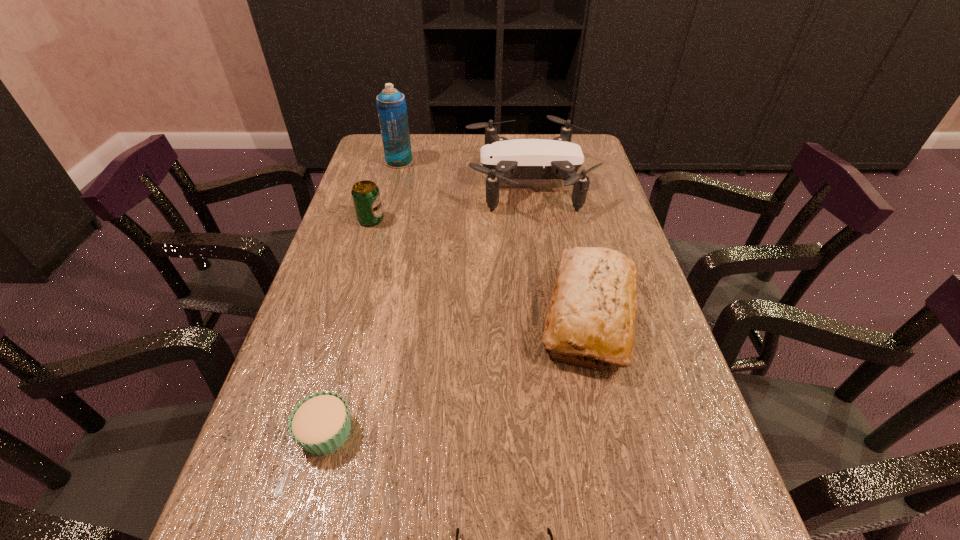
Image resolution: width=960 pixels, height=540 pixels. What are the coordinates of `free space between the bread and the aerosol can` in the screenshot? It's located at (494, 238).

You are a GUI agent. You are given a task and a screenshot of the screen. Output one action in this format:
    pyautogui.click(x=<x>, y=<y>)
    Task: Click on the vacant region between the drone and the fifth farthest object
    Image resolution: width=960 pixels, height=540 pixels.
    Given the screenshot: What is the action you would take?
    pyautogui.click(x=427, y=307)

At what (x,y) coordinates should I click in order to perform the action: click on the fifth closest object to the spectacles. Please return your answer as a coordinate pair (x, y). Looking at the image, I should click on pyautogui.click(x=391, y=105).

At what (x,y) coordinates should I click in order to perform the action: click on object that is the second closest one to the beer can. Please return your answer as a coordinate pair (x, y). The height and width of the screenshot is (540, 960). Looking at the image, I should click on pos(391,105).